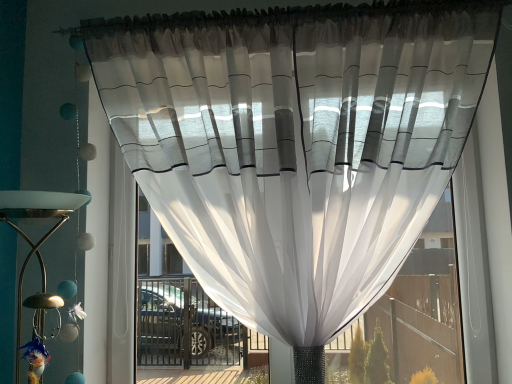
In order to face gold metallic mobile at left, should I rotate leftwards or rightwards?

Rotate your view left by about 25.548°.

What do you see at coordinates (37, 245) in the screenshot? The width and height of the screenshot is (512, 384). I see `gold metallic mobile at left` at bounding box center [37, 245].

Image resolution: width=512 pixels, height=384 pixels. I want to click on gold metallic mobile at left, so (x=37, y=245).

At what (x,y) coordinates should I click in order to perform the action: click on gold metallic mobile at left. Please return your answer as a coordinate pair (x, y). Image resolution: width=512 pixels, height=384 pixels. Looking at the image, I should click on (37, 245).